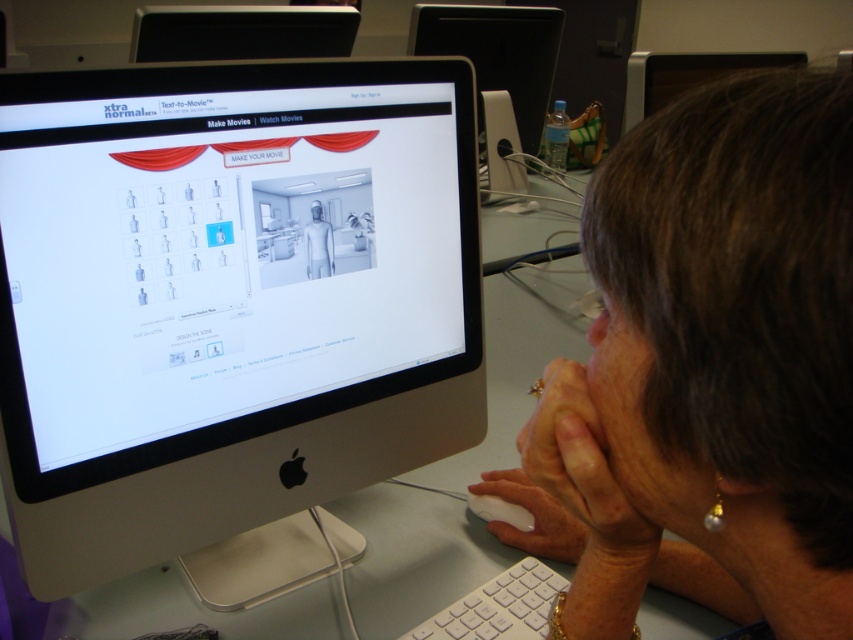
Question: Which point is farther to the camera?

Choices:
 (A) (20, 116)
 (B) (630, 508)
 (C) (511, 474)
 (D) (466, 499)

Answer: (D)

Question: Which of the following is the closest to the observer?

Choices:
 (A) (321, 237)
 (B) (473, 612)
 (C) (514, 504)
 (D) (196, 22)

Answer: (B)

Question: Is silver/black plastic monitor at center thinner than white glossy mouse at lower center?

Choices:
 (A) yes
 (B) no

Answer: (B)

Question: Can you confirm if black glossy monitor at upper center is positioned above white matte mouse at lower center?

Choices:
 (A) yes
 (B) no

Answer: (A)

Question: Is smooth skin hands at center positioned in front of white matte mannequin at center?

Choices:
 (A) yes
 (B) no

Answer: (A)

Question: Which point is farther from the camera taking this photo?

Choices:
 (A) (270, 19)
 (B) (515, 516)
 (C) (456, 29)
 (D) (780, 216)

Answer: (C)